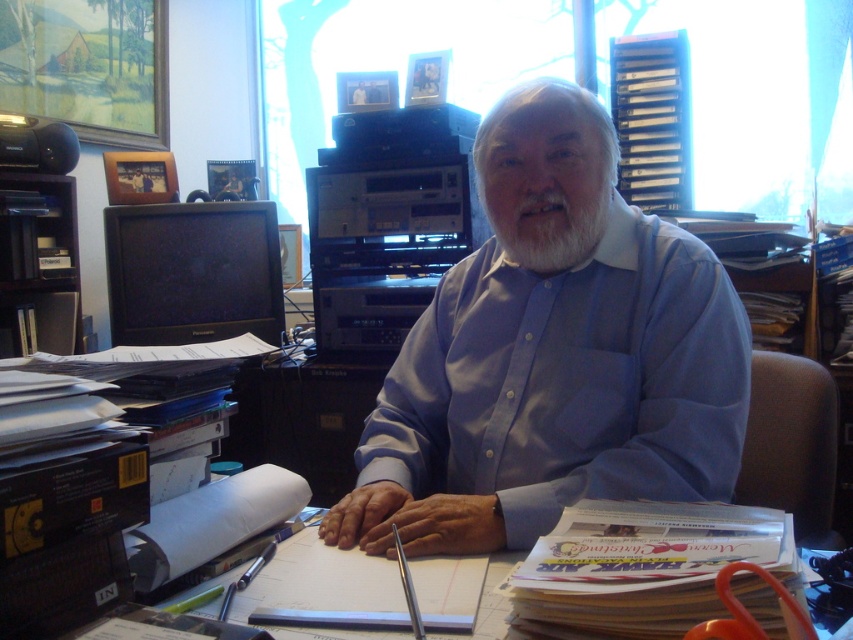
Measure the distance between point (526, 138) and camera.

Point (526, 138) and camera are 1.09 meters apart from each other.

Does blue smooth shirt at center have a greater width compared to white soft beard at center?

Indeed, blue smooth shirt at center has a greater width compared to white soft beard at center.

Where is `blue smooth shirt at center`? The height and width of the screenshot is (640, 853). blue smooth shirt at center is located at coordinates click(552, 355).